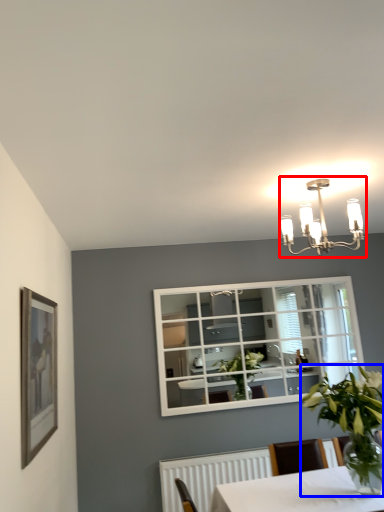
Question: Which object is closer to the camera taking this photo, lamp (highlighted by a red box) or houseplant (highlighted by a blue box)?

Choices:
 (A) lamp
 (B) houseplant

Answer: (B)